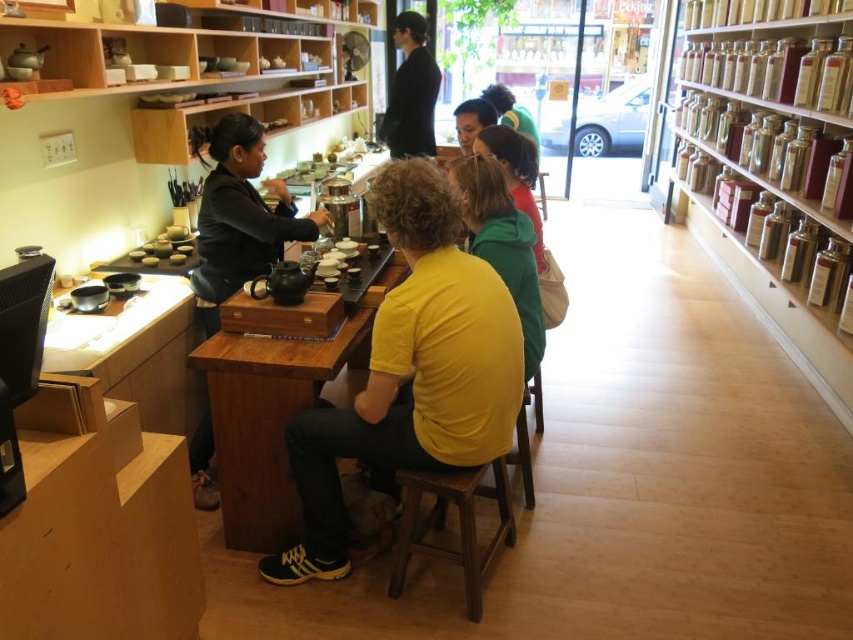
You are standing in the tea shop and want to take a photo of both the counter with the woman preparing tea and the street outside through the large windows. Which point, point (x=438, y=424) or point (x=258, y=257), should you focus on to ensure both the counter and the street are in clear view?

You should focus on point (x=438, y=424) because it is closer to the camera than point (x=258, y=257), ensuring both the counter and the street are in clear view.